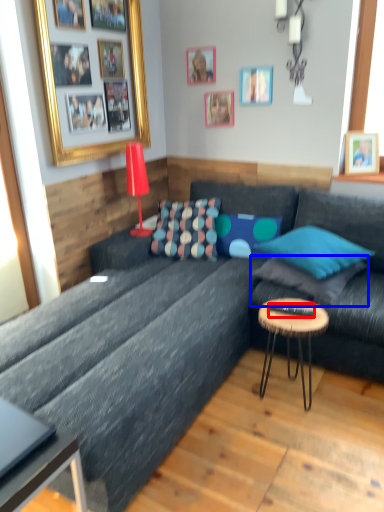
Question: Among these objects, which one is farthest to the camera, remote control (highlighted by a red box) or pillow (highlighted by a blue box)?

Choices:
 (A) remote control
 (B) pillow

Answer: (B)